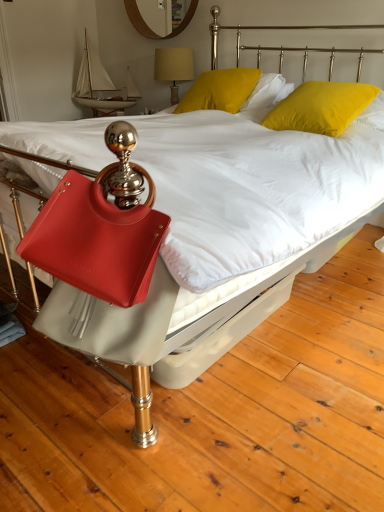
Question: From the image's perspective, is matte yellow lampshade at upper center under yellow velvet pillow at upper right, the first pillow in the right-to-left sequence?

Choices:
 (A) yes
 (B) no

Answer: (B)

Question: Does matte yellow lampshade at upper center come in front of yellow velvet pillow at upper right, placed as the 2th pillow when sorted from left to right?

Choices:
 (A) no
 (B) yes

Answer: (A)

Question: Is matte yellow lampshade at upper center not near yellow velvet pillow at upper right, the first pillow in the right-to-left sequence?

Choices:
 (A) no
 (B) yes

Answer: (B)

Question: Can you confirm if matte yellow lampshade at upper center is thinner than yellow velvet pillow at upper right, the first pillow in the right-to-left sequence?

Choices:
 (A) no
 (B) yes

Answer: (B)

Question: Is matte yellow lampshade at upper center at the right side of yellow velvet pillow at upper right, the first pillow in the right-to-left sequence?

Choices:
 (A) yes
 (B) no

Answer: (B)

Question: Considering the positions of wooden mirror at upper center and satin red handbag at lower left in the image, is wooden mirror at upper center taller or shorter than satin red handbag at lower left?

Choices:
 (A) tall
 (B) short

Answer: (A)

Question: In the image, is wooden mirror at upper center on the left side or the right side of satin red handbag at lower left?

Choices:
 (A) right
 (B) left

Answer: (B)

Question: Do you think wooden mirror at upper center is within satin red handbag at lower left, or outside of it?

Choices:
 (A) outside
 (B) inside

Answer: (A)

Question: From a real-world perspective, is wooden mirror at upper center physically located above or below satin red handbag at lower left?

Choices:
 (A) above
 (B) below

Answer: (A)

Question: From a real-world perspective, is yellow velvet pillow at upper right, the first pillow in the right-to-left sequence, physically located above or below wooden mirror at upper center?

Choices:
 (A) below
 (B) above

Answer: (A)

Question: Based on their sizes in the image, would you say yellow velvet pillow at upper right, placed as the 2th pillow when sorted from left to right, is bigger or smaller than wooden mirror at upper center?

Choices:
 (A) small
 (B) big

Answer: (B)

Question: Does point (332, 112) appear closer or farther from the camera than point (137, 18)?

Choices:
 (A) closer
 (B) farther

Answer: (A)

Question: Is yellow velvet pillow at upper right, placed as the 2th pillow when sorted from left to right, to the left or to the right of wooden mirror at upper center in the image?

Choices:
 (A) right
 (B) left

Answer: (A)

Question: Visually, is matte yellow lampshade at upper center positioned to the left or to the right of wooden mirror at upper center?

Choices:
 (A) left
 (B) right

Answer: (B)

Question: Is matte yellow lampshade at upper center situated inside wooden mirror at upper center or outside?

Choices:
 (A) outside
 (B) inside

Answer: (A)